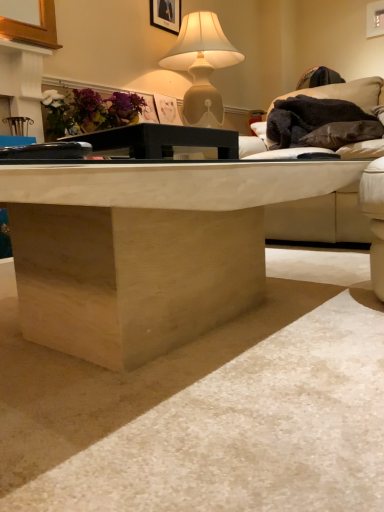
Question: From a real-world perspective, is matte beige lamp at upper center beneath matte floral arrangement at upper left?

Choices:
 (A) no
 (B) yes

Answer: (A)

Question: Does matte beige lamp at upper center come in front of matte floral arrangement at upper left?

Choices:
 (A) yes
 (B) no

Answer: (B)

Question: Considering the relative sizes of matte beige lamp at upper center and matte floral arrangement at upper left in the image provided, is matte beige lamp at upper center bigger than matte floral arrangement at upper left?

Choices:
 (A) no
 (B) yes

Answer: (B)

Question: Does matte beige lamp at upper center appear on the left side of matte floral arrangement at upper left?

Choices:
 (A) no
 (B) yes

Answer: (A)

Question: Considering the relative sizes of matte beige lamp at upper center and matte floral arrangement at upper left in the image provided, is matte beige lamp at upper center smaller than matte floral arrangement at upper left?

Choices:
 (A) no
 (B) yes

Answer: (A)

Question: From a real-world perspective, relative to black fuzzy blanket at upper right, is matte black picture frame at upper center vertically above or below?

Choices:
 (A) below
 (B) above

Answer: (B)

Question: Visually, is matte black picture frame at upper center positioned to the left or to the right of black fuzzy blanket at upper right?

Choices:
 (A) left
 (B) right

Answer: (A)

Question: Is point pyautogui.click(x=170, y=10) closer or farther from the camera than point pyautogui.click(x=306, y=112)?

Choices:
 (A) farther
 (B) closer

Answer: (A)

Question: Do you think matte black picture frame at upper center is within black fuzzy blanket at upper right, or outside of it?

Choices:
 (A) outside
 (B) inside

Answer: (A)

Question: From their relative heights in the image, would you say black fuzzy blanket at upper right is taller or shorter than matte floral arrangement at upper left?

Choices:
 (A) short
 (B) tall

Answer: (B)

Question: In the image, is black fuzzy blanket at upper right positioned in front of or behind matte floral arrangement at upper left?

Choices:
 (A) behind
 (B) front

Answer: (A)

Question: Considering the relative positions of black fuzzy blanket at upper right and matte floral arrangement at upper left in the image provided, is black fuzzy blanket at upper right to the left or to the right of matte floral arrangement at upper left?

Choices:
 (A) right
 (B) left

Answer: (A)

Question: In terms of width, does black fuzzy blanket at upper right look wider or thinner when compared to matte floral arrangement at upper left?

Choices:
 (A) thin
 (B) wide

Answer: (B)

Question: Is point (205, 426) closer or farther from the camera than point (230, 133)?

Choices:
 (A) closer
 (B) farther

Answer: (A)

Question: Is natural wood coffee table at center inside or outside of black matte table at center?

Choices:
 (A) outside
 (B) inside

Answer: (A)